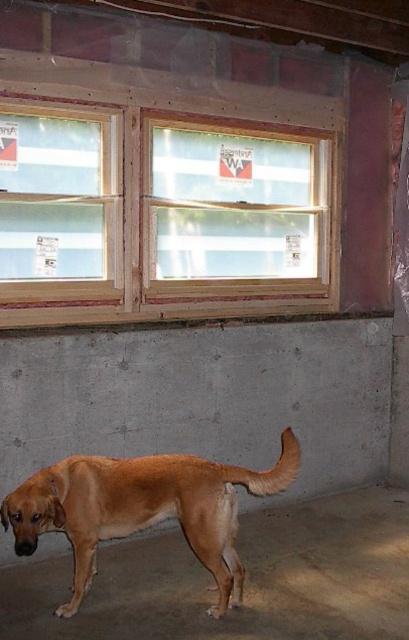
Can you confirm if wooden frame at upper left is positioned to the right of brown matte dog at lower left?

No, wooden frame at upper left is not to the right of brown matte dog at lower left.

Can you confirm if wooden frame at upper left is taller than brown matte dog at lower left?

Correct, wooden frame at upper left is much taller as brown matte dog at lower left.

This screenshot has height=640, width=409. I want to click on wooden frame at upper left, so click(x=60, y=204).

Can you confirm if clear glass window at center is positioned to the right of brown matte dog at lower left?

Indeed, clear glass window at center is positioned on the right side of brown matte dog at lower left.

Does clear glass window at center have a greater width compared to brown matte dog at lower left?

No, clear glass window at center is not wider than brown matte dog at lower left.

Locate an element on the screen. The image size is (409, 640). clear glass window at center is located at coordinates (233, 211).

What are the coordinates of `clear glass window at center` in the screenshot? It's located at (233, 211).

Between wooden frame at upper center and brown matte dog at lower left, which one has less height?

brown matte dog at lower left

Is wooden frame at upper center to the left of brown matte dog at lower left from the viewer's perspective?

Incorrect, wooden frame at upper center is not on the left side of brown matte dog at lower left.

Does point (182, 179) lie behind point (123, 481)?

Yes, point (182, 179) is behind point (123, 481).

Find the location of a particular element. The image size is (409, 640). wooden frame at upper center is located at coordinates (161, 216).